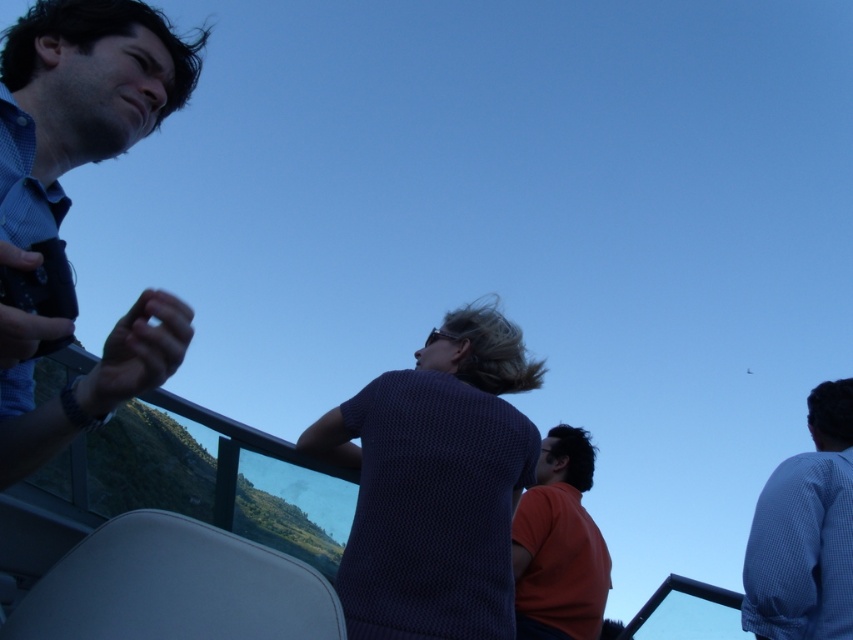
You are a photographer trying to capture a group photo. You notice two people in the scene wearing shirts labeled as dark blue textured shirt at center and blue checkered shirt at upper right. Which shirt is positioned closer to the camera?

The dark blue textured shirt at center is closer to the viewer than the blue checkered shirt at upper right, so the dark blue textured shirt at center would be the one closer to the camera.

Consider the image. You are standing in the scene and want to take a photo of both the point at (424, 429) and the point at (109, 6). Which point should you focus on first to ensure both are in focus?

You should focus on the point at (109, 6) first because it is closer to you than the point at (424, 429). By focusing on the closer point, the further point will also be in focus due to depth of field.